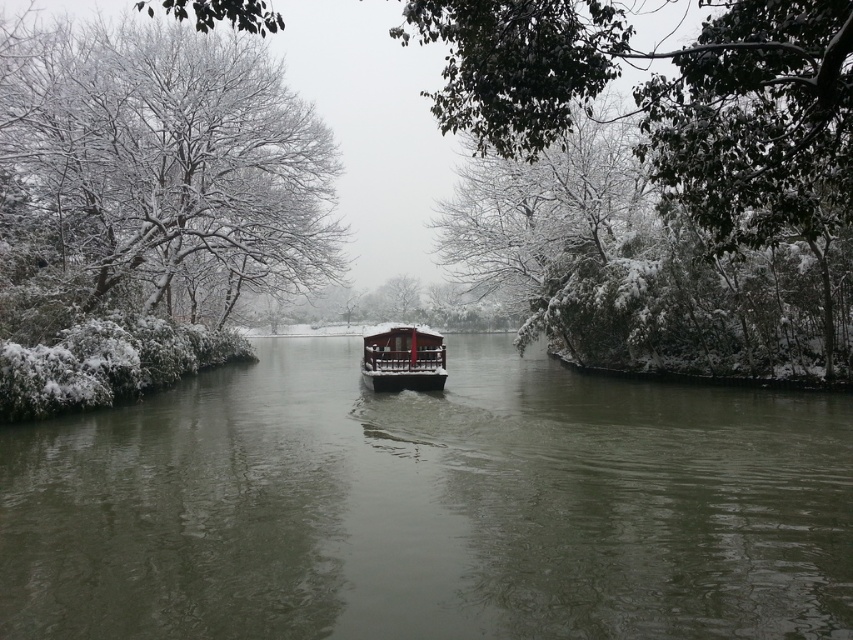
You are standing at the edge of the river in the winter scene. You notice a point marked at coordinates (430, 508). What is the color of the water at that point?

The point at coordinates (430, 508) marks greenish gray water at center.